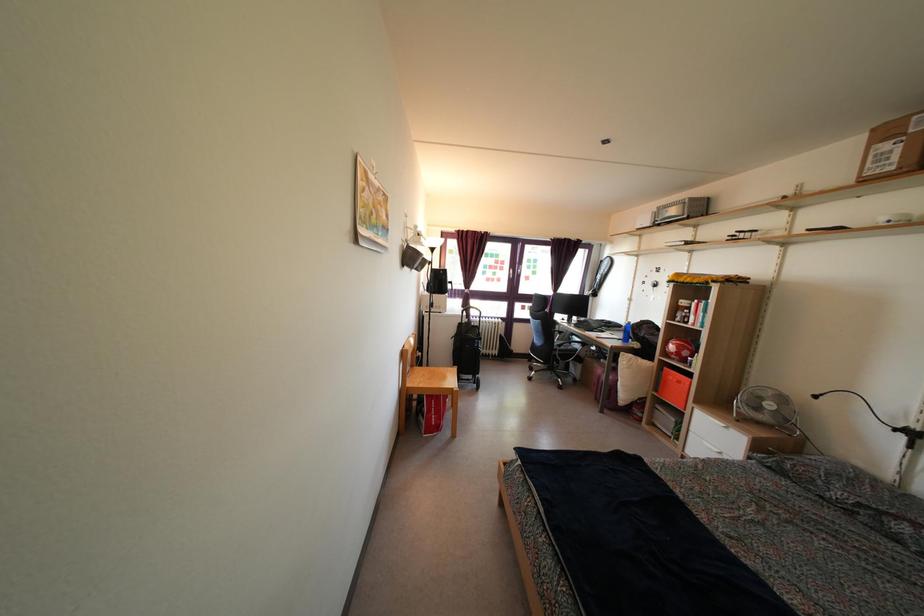
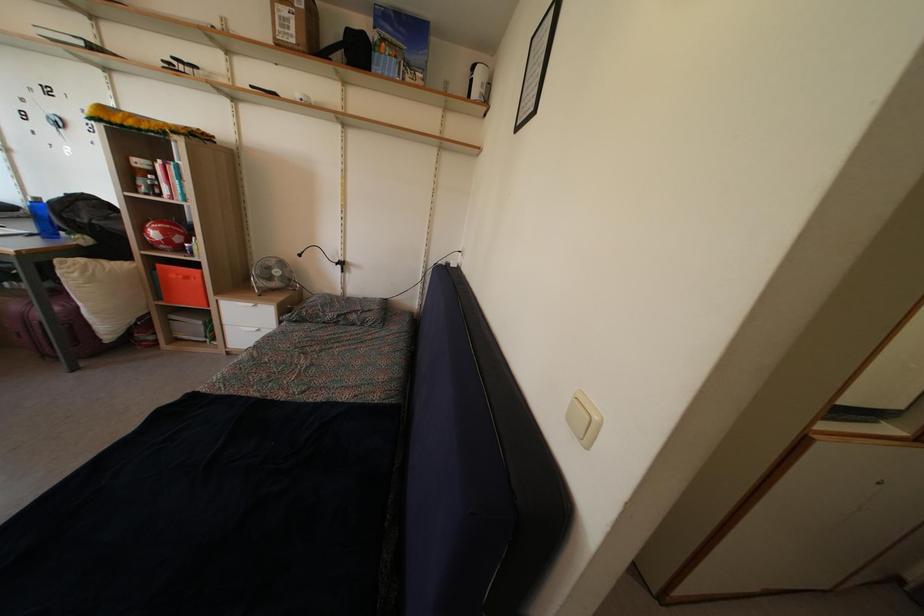
Where in the second image is the point corresponding to the point at 675,357 from the first image?

(157, 243)